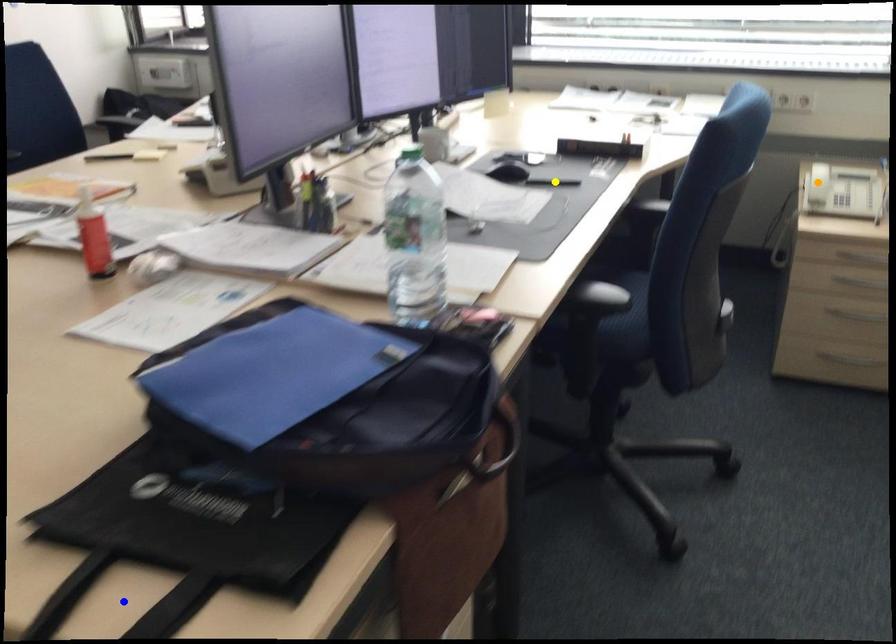
Order these from nearest to farthest:
blue point | yellow point | orange point

blue point, yellow point, orange point